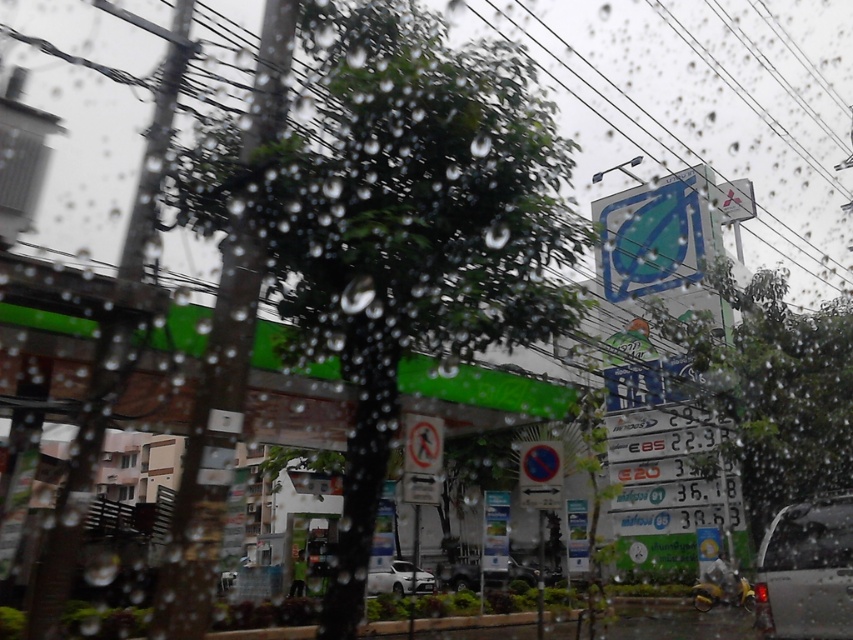
Is point (465, 586) positioned behind point (390, 582)?

Yes, it is behind point (390, 582).

Locate an element on the screen. metallic silver suv at center is located at coordinates click(459, 573).

Does point (780, 618) come closer to viewer compared to point (393, 563)?

Yes.

Does metallic silver car at lower right appear over white matte car at center?

Indeed, metallic silver car at lower right is positioned over white matte car at center.

What do you see at coordinates (805, 572) in the screenshot? I see `metallic silver car at lower right` at bounding box center [805, 572].

Find the location of a particular element. This screenshot has height=640, width=853. metallic silver car at lower right is located at coordinates (805, 572).

Who is higher up, metallic silver car at lower right or metallic silver suv at center?

metallic silver car at lower right is higher up.

Does metallic silver car at lower right have a larger size compared to metallic silver suv at center?

No, metallic silver car at lower right is not bigger than metallic silver suv at center.

Who is more distant from viewer, (769, 563) or (460, 586)?

Positioned behind is point (460, 586).

Identify the location of metallic silver car at lower right. The image size is (853, 640). click(805, 572).